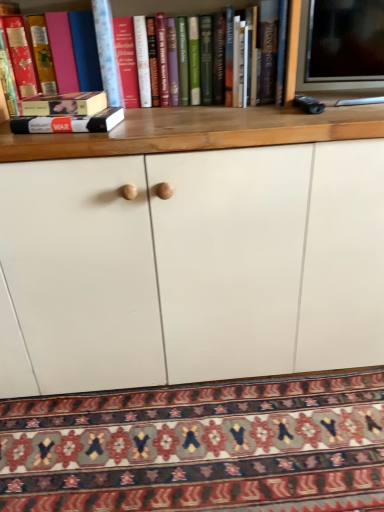
At what (x,y) coordinates should I click in order to perform the action: click on matte pink book at left, arranged as the first book when viewed from the top. Please return your answer as a coordinate pair (x, y). Looking at the image, I should click on coord(16,61).

Image resolution: width=384 pixels, height=512 pixels. What are the coordinates of `patterned carpet at lower center` in the screenshot? It's located at (200, 446).

Which of these two, hardcover book at left, marked as the first book in a bottom-to-top arrangement, or matte pink book at left, the 1th book in the left-to-right sequence, is bigger?

With larger size is matte pink book at left, the 1th book in the left-to-right sequence.

Which is nearer, (x=120, y=113) or (x=39, y=42)?

Point (x=120, y=113).

From the image's perspective, relative to matte pink book at left, arranged as the first book when viewed from the top, is hardcover book at left, which appears as the second book when viewed from the top, above or below?

From the image's perspective, hardcover book at left, which appears as the second book when viewed from the top, appears below matte pink book at left, arranged as the first book when viewed from the top.

Is hardcover book at left, marked as the first book in a bottom-to-top arrangement, located outside matte pink book at left, which is counted as the 2th book, starting from the bottom?

That's correct, hardcover book at left, marked as the first book in a bottom-to-top arrangement, is outside of matte pink book at left, which is counted as the 2th book, starting from the bottom.

From the image's perspective, which is below, matte pink book at left, which is the 2th book from right to left, or patterned carpet at lower center?

patterned carpet at lower center is shown below in the image.

Find the location of a particular element. mat that is under the matte pink book at left, which is the 2th book from right to left (from a real-world perspective) is located at coordinates (200, 446).

Which object is positioned more to the left, matte pink book at left, which is the 2th book from right to left, or patterned carpet at lower center?

matte pink book at left, which is the 2th book from right to left, is more to the left.

How distant is matte pink book at left, arranged as the first book when viewed from the top, from patterned carpet at lower center?

1.03 meters.

Is matte pink book at left, which is counted as the 2th book, starting from the bottom, aimed at hardcover book at left, marked as the first book in a bottom-to-top arrangement?

No, matte pink book at left, which is counted as the 2th book, starting from the bottom, is not aimed at hardcover book at left, marked as the first book in a bottom-to-top arrangement.

From the image's perspective, is matte pink book at left, which is counted as the 2th book, starting from the bottom, above or below hardcover book at left, which is the second book from left to right?

matte pink book at left, which is counted as the 2th book, starting from the bottom, is above hardcover book at left, which is the second book from left to right.

How different are the orientations of matte pink book at left, arranged as the first book when viewed from the top, and hardcover book at left, marked as the first book in a bottom-to-top arrangement, in degrees?

5.13 degrees.

Which object is more forward, matte pink book at left, which is the 2th book from right to left, or hardcover book at left, the first book viewed from the right?

hardcover book at left, the first book viewed from the right.

Is patterned carpet at lower center next to matte pink book at left, which is the 2th book from right to left, and touching it?

No, patterned carpet at lower center is not with matte pink book at left, which is the 2th book from right to left.

Is patterned carpet at lower center surrounding matte pink book at left, which is the 2th book from right to left?

Actually, matte pink book at left, which is the 2th book from right to left, is outside patterned carpet at lower center.

Which is more to the right, patterned carpet at lower center or matte pink book at left, arranged as the first book when viewed from the top?

patterned carpet at lower center.

Is hardcover book at left, marked as the first book in a bottom-to-top arrangement, beside patterned carpet at lower center?

No, hardcover book at left, marked as the first book in a bottom-to-top arrangement, is not beside patterned carpet at lower center.

From a real-world perspective, is hardcover book at left, the first book viewed from the right, positioned above or below patterned carpet at lower center?

hardcover book at left, the first book viewed from the right, is above patterned carpet at lower center.

Which is closer to the camera, (96, 115) or (197, 398)?

Positioned in front is point (96, 115).

From a real-world perspective, is patterned carpet at lower center above or below hardcover book at left, which appears as the second book when viewed from the top?

patterned carpet at lower center is below hardcover book at left, which appears as the second book when viewed from the top.

Is hardcover book at left, marked as the first book in a bottom-to-top arrangement, a part of patterned carpet at lower center?

No, hardcover book at left, marked as the first book in a bottom-to-top arrangement, is not surrounded by patterned carpet at lower center.

Does patterned carpet at lower center turn towards hardcover book at left, which is the second book from left to right?

No.

Does point (312, 395) come behind point (42, 118)?

Yes, point (312, 395) is farther from viewer.

Identify the location of book located on the left of hardcover book at left, the first book viewed from the right. This screenshot has height=512, width=384. (16, 61).

Find the location of a particular element. This screenshot has height=512, width=384. mat that appears in front of the matte pink book at left, which is the 2th book from right to left is located at coordinates (200, 446).

Estimate the real-world distances between objects in this image. Which object is further from patterned carpet at lower center, matte pink book at left, arranged as the first book when viewed from the top, or hardcover book at left, which is the second book from left to right?

Based on the image, matte pink book at left, arranged as the first book when viewed from the top, appears to be further to patterned carpet at lower center.

From the image, which object appears to be nearer to patterned carpet at lower center, hardcover book at left, which is the second book from left to right, or matte pink book at left, arranged as the first book when viewed from the top?

Based on the image, hardcover book at left, which is the second book from left to right, appears to be nearer to patterned carpet at lower center.

When comparing their distances from matte pink book at left, the 1th book in the left-to-right sequence, does patterned carpet at lower center or hardcover book at left, the first book viewed from the right, seem further?

patterned carpet at lower center is further to matte pink book at left, the 1th book in the left-to-right sequence.

From the picture: Looking at the image, which one is located further to hardcover book at left, marked as the first book in a bottom-to-top arrangement, patterned carpet at lower center or matte pink book at left, which is the 2th book from right to left?

patterned carpet at lower center is positioned further to the anchor hardcover book at left, marked as the first book in a bottom-to-top arrangement.

Considering their positions, is matte pink book at left, the 1th book in the left-to-right sequence, positioned closer to hardcover book at left, marked as the first book in a bottom-to-top arrangement, than patterned carpet at lower center?

The object closer to hardcover book at left, marked as the first book in a bottom-to-top arrangement, is matte pink book at left, the 1th book in the left-to-right sequence.

Estimate the real-world distances between objects in this image. Which object is further from matte pink book at left, arranged as the first book when viewed from the top, hardcover book at left, the first book viewed from the right, or patterned carpet at lower center?

Among the two, patterned carpet at lower center is located further to matte pink book at left, arranged as the first book when viewed from the top.

At what (x,y) coordinates should I click in order to perform the action: click on book between matte pink book at left, which is counted as the 2th book, starting from the bottom, and patterned carpet at lower center vertically. Please return your answer as a coordinate pair (x, y). Looking at the image, I should click on (68, 123).